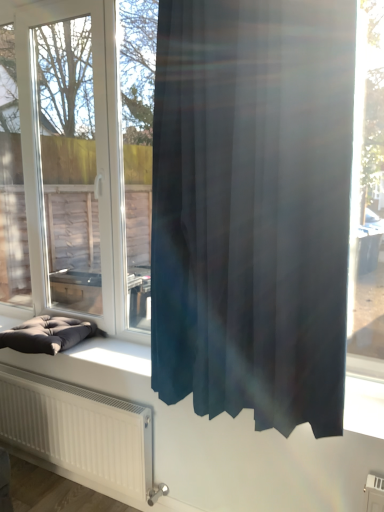
Question: Would you say dark gray fabric cushion at lower left is to the left or to the right of satin dark blue curtain at center in the picture?

Choices:
 (A) left
 (B) right

Answer: (A)

Question: Considering their positions, is dark gray fabric cushion at lower left located in front of or behind satin dark blue curtain at center?

Choices:
 (A) front
 (B) behind

Answer: (B)

Question: Which of these objects is positioned closest to the satin dark blue curtain at center?

Choices:
 (A) transparent glass window at center
 (B) dark gray fabric cushion at lower left

Answer: (B)

Question: Estimate the real-world distances between objects in this image. Which object is farther from the transparent glass window at center?

Choices:
 (A) satin dark blue curtain at center
 (B) dark gray fabric cushion at lower left

Answer: (A)